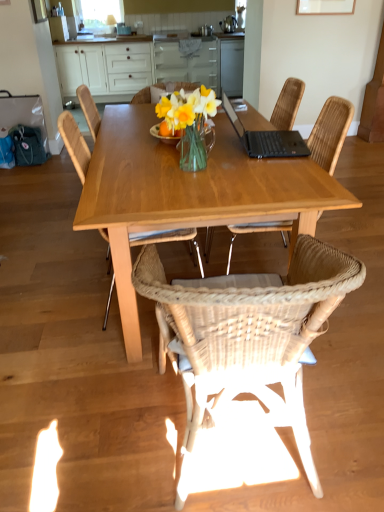
Locate an element on the screen. Image resolution: width=384 pixels, height=512 pixels. vacant space in front of black matte laptop at upper right is located at coordinates (269, 177).